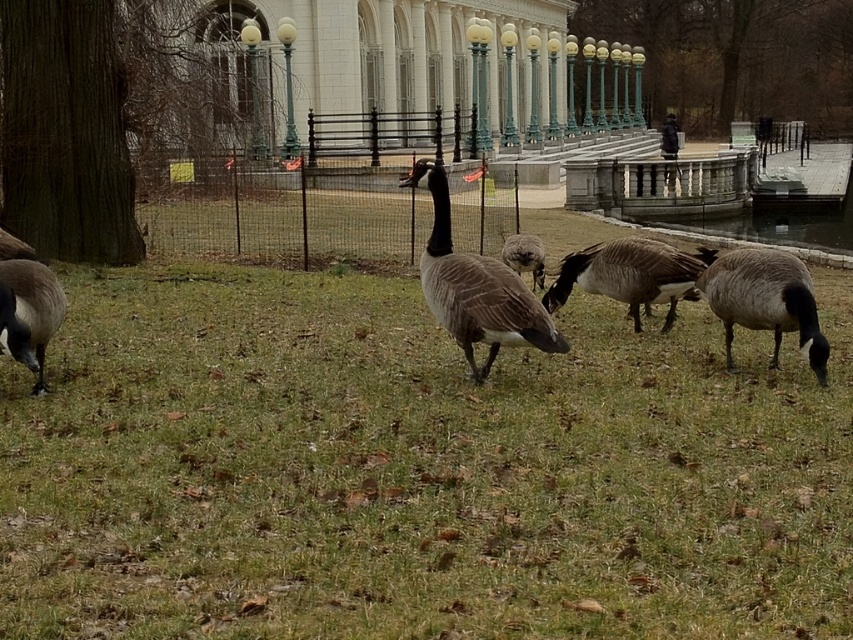
Question: Which of the following is the farthest from the observer?

Choices:
 (A) (618, 284)
 (B) (506, 202)
 (C) (697, 280)
 (D) (317, 508)

Answer: (B)

Question: Which of the following is the closest to the observer?

Choices:
 (A) (427, 285)
 (B) (525, 269)
 (C) (788, 419)

Answer: (C)

Question: Can you confirm if metal wire fence at center is positioned above brown feathered goose at lower left?

Choices:
 (A) yes
 (B) no

Answer: (A)

Question: Considering the real-world distances, which object is farthest from the brown matte duck at center?

Choices:
 (A) gray matte goose at center
 (B) brown feathered goose at lower left
 (C) brown feathered goose at center
 (D) dark brown feathers at center

Answer: (B)

Question: Is brown feathered goose at center above brown feathered goose at lower left?

Choices:
 (A) no
 (B) yes

Answer: (B)

Question: Is metal wire fence at center smaller than brown matte duck at center?

Choices:
 (A) no
 (B) yes

Answer: (A)